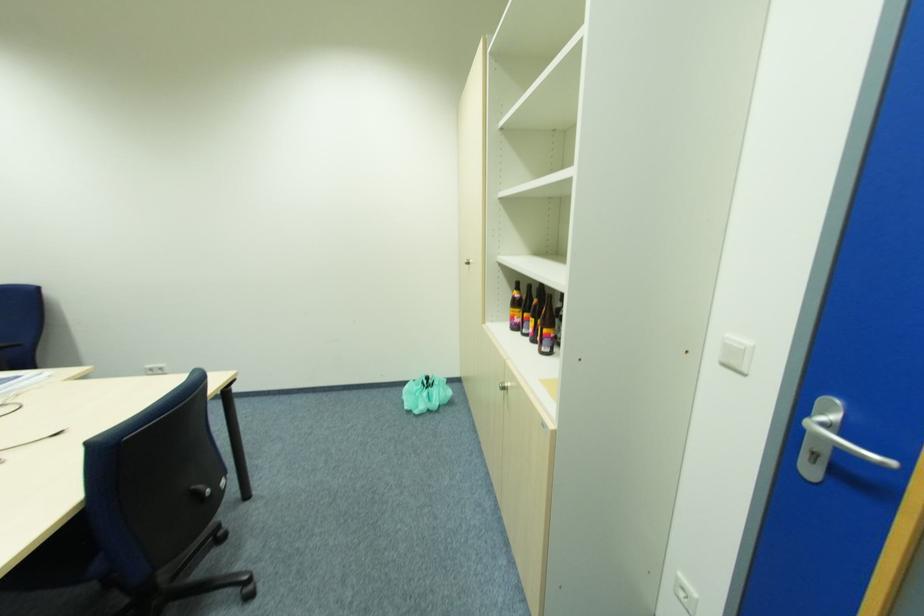
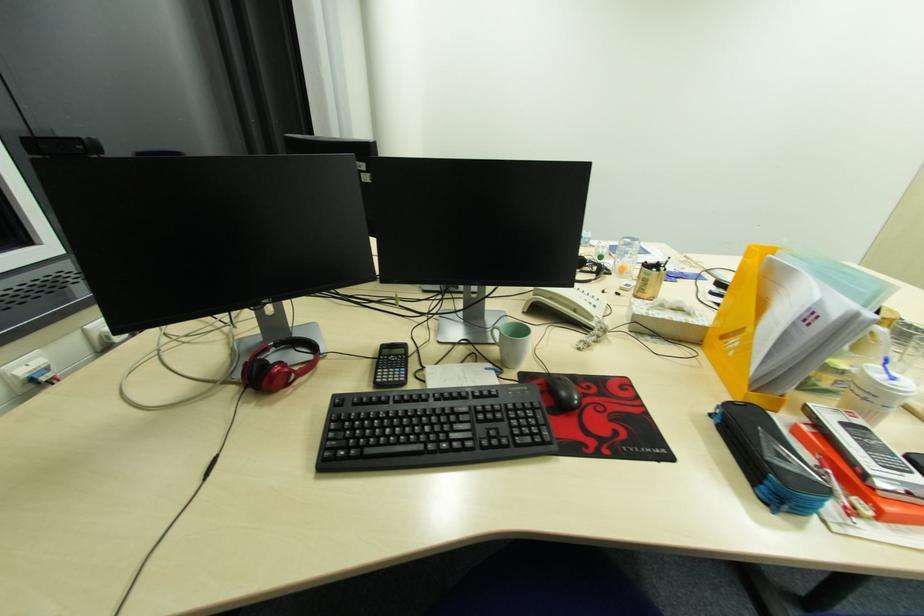
Question: The images are taken continuously from a first-person perspective. In which direction are you moving?

Choices:
 (A) Left
 (B) Right
 (C) Forward
 (D) Backward

Answer: (A)